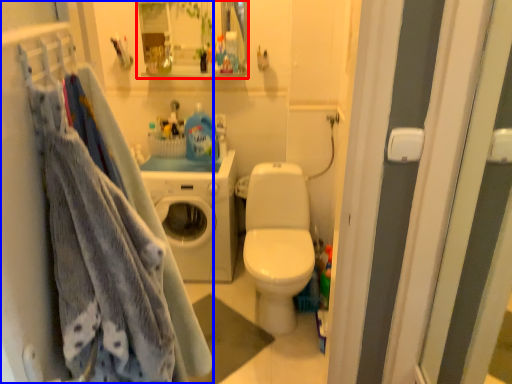
Question: Which point is closer to the camera, cabinet (highlighted by a red box) or closet (highlighted by a blue box)?

Choices:
 (A) cabinet
 (B) closet

Answer: (B)